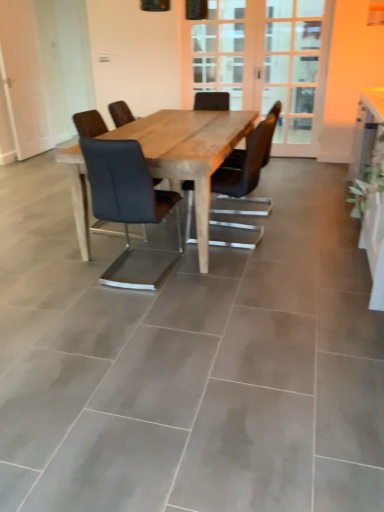
Find the location of a particular element. vacant area situated to the left side of white glossy computer desk at right is located at coordinates (285, 286).